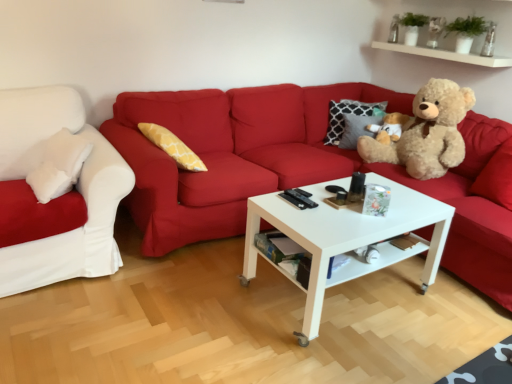
This screenshot has height=384, width=512. What are the coordinates of `vacant space to the right of white glossy coffee table at center` in the screenshot? It's located at (451, 315).